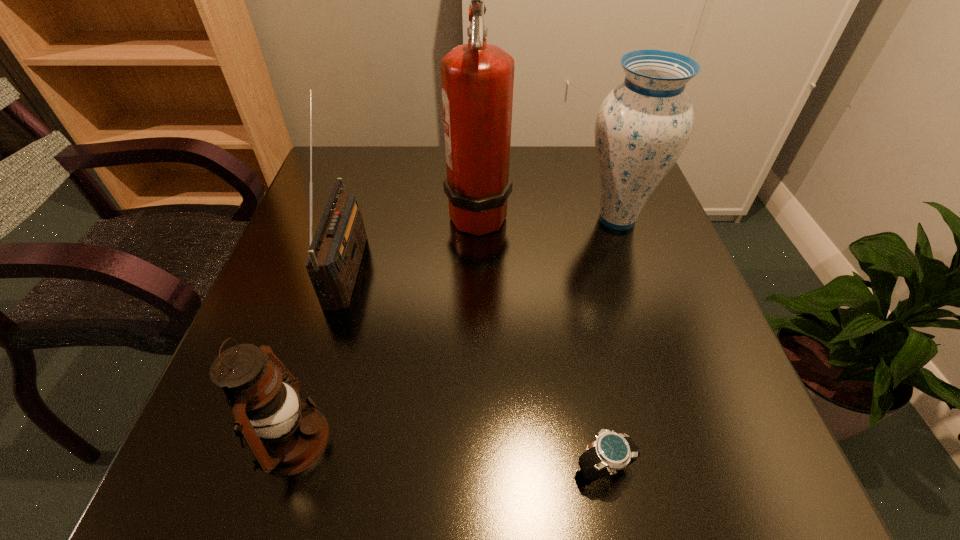
You are a GUI agent. You are given a task and a screenshot of the screen. Output one action in this format:
    pyautogui.click(x=<x>, y=<y>)
    Task: Click on the vacant area that satisfies the following two spatial constraints: 1. on the side of the watch, there is a wick adjustment knob; 2. on the right side of the fourth tallest object
    
    Given the screenshot: What is the action you would take?
    pyautogui.click(x=285, y=467)

The width and height of the screenshot is (960, 540). I want to click on vacant point that satisfies the following two spatial constraints: 1. at the nozzle of the fire extinguisher; 2. on the back side of the rightmost object, so point(478,219).

This screenshot has height=540, width=960. I want to click on vacant area in the image that satisfies the following two spatial constraints: 1. at the nozzle of the rightmost object; 2. on the right side of the tallest object, so click(x=478, y=219).

Where is `vacant space that satisfies the following two spatial constraints: 1. on the back side of the watch; 2. on the side of the lantern, there is a wick adjustment knob`? This screenshot has width=960, height=540. vacant space that satisfies the following two spatial constraints: 1. on the back side of the watch; 2. on the side of the lantern, there is a wick adjustment knob is located at coordinates (598, 440).

The image size is (960, 540). Find the location of `vacant area that satisfies the following two spatial constraints: 1. on the back side of the vase; 2. at the nozzle of the tallest object`. vacant area that satisfies the following two spatial constraints: 1. on the back side of the vase; 2. at the nozzle of the tallest object is located at coordinates (615, 212).

This screenshot has width=960, height=540. I want to click on free space that satisfies the following two spatial constraints: 1. on the front-facing side of the radio receiver; 2. on the left side of the shortest object, so click(288, 467).

The height and width of the screenshot is (540, 960). What are the coordinates of `blank space that satisfies the following two spatial constraints: 1. at the nozzle of the fourth object from left to right; 2. on the right side of the third object from right to left` in the screenshot? It's located at (477, 467).

Find the location of a particular element. Image resolution: width=960 pixels, height=540 pixels. free spot that satisfies the following two spatial constraints: 1. on the back side of the watch; 2. on the front-facing side of the radio receiver is located at coordinates [x=564, y=265].

Identify the location of free space that satisfies the following two spatial constraints: 1. at the nozzle of the tallest object; 2. on the left side of the second object from right to left. This screenshot has width=960, height=540. (477, 467).